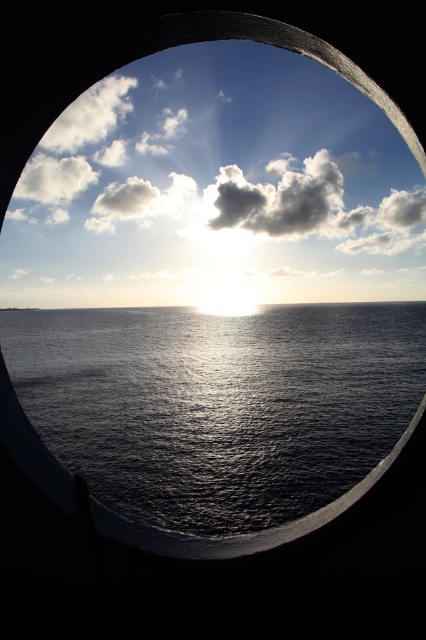
You are an astronomer analyzing the image through a telescope. The telescope can only focus on objects within a 0.1 unit radius around the point 0.3, 0.5. Can you observe the cloudy sky at upper center in this area?

The cloudy sky at upper center is located at point (215, 188), which is within the telescope focus area of 0.1 unit radius around (213, 192). Therefore, yes, you can observe the cloudy sky at upper center through the telescope.

You are a sailor observing the seascape through the porthole. Which object occupies a larger portion of your view, the cloudy sky at upper center or the glistening dark water at center?

The cloudy sky at upper center occupies a larger portion of the view than the glistening dark water at center.

You are an observer looking through the porthole. You notice the glistening dark water at center and the white fluffy cloud at upper center. Which of these two objects occupies a wider area in the scene?

The glistening dark water at center occupies a wider area than the white fluffy cloud at upper center, as its width surpasses that of the cloud.